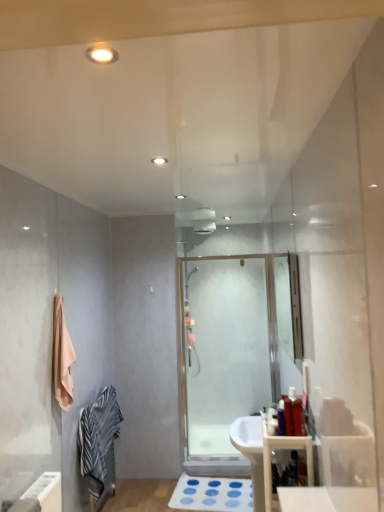
Measure the distance between wooden storage at lower right and camera.

The distance of wooden storage at lower right from camera is 1.92 meters.

Describe the element at coordinates (99, 444) in the screenshot. I see `striped cotton bathrobe at lower left` at that location.

Find the location of a particular element. The image size is (384, 512). wooden storage at lower right is located at coordinates (283, 448).

Considering the relative positions of white glossy light fixture at upper center and striped cotton bathrobe at lower left in the image provided, is white glossy light fixture at upper center behind striped cotton bathrobe at lower left?

No.

Considering the positions of points (96, 58) and (93, 469), is point (96, 58) farther from camera compared to point (93, 469)?

No, it is not.

Is white glossy light fixture at upper center wider or thinner than striped cotton bathrobe at lower left?

In the image, white glossy light fixture at upper center appears to be more narrow than striped cotton bathrobe at lower left.

Which of these two, white glossy light fixture at upper center or striped cotton bathrobe at lower left, stands shorter?

Standing shorter between the two is white glossy light fixture at upper center.

Is wooden storage at lower right in front of or behind white rubber bath mat at lower center in the image?

wooden storage at lower right is in front of white rubber bath mat at lower center.

Does point (265, 503) appear closer or farther from the camera than point (240, 489)?

Point (265, 503) is positioned closer to the camera compared to point (240, 489).

Can you confirm if wooden storage at lower right is thinner than white rubber bath mat at lower center?

Yes, wooden storage at lower right is thinner than white rubber bath mat at lower center.

Is wooden storage at lower right next to white rubber bath mat at lower center?

They are not placed beside each other.

Which of these two, striped cotton bathrobe at lower left or beige cotton towel at left, stands shorter?

With less height is beige cotton towel at left.

Is point (87, 409) closer or farther from the camera than point (65, 381)?

Point (87, 409) is farther from the camera than point (65, 381).

Based on their positions, is striped cotton bathrobe at lower left located to the left or right of beige cotton towel at left?

From the image, it's evident that striped cotton bathrobe at lower left is to the right of beige cotton towel at left.

Considering their positions, is striped cotton bathrobe at lower left located in front of or behind beige cotton towel at left?

striped cotton bathrobe at lower left is behind beige cotton towel at left.

Does clear glass mirror at center lie behind beige cotton towel at left?

No, clear glass mirror at center is closer to the camera.

This screenshot has width=384, height=512. Find the location of `bath towel that appears below the clear glass mirror at center (from a real-world perspective)`. bath towel that appears below the clear glass mirror at center (from a real-world perspective) is located at coordinates (62, 357).

What's the angular difference between clear glass mirror at center and beige cotton towel at left's facing directions?

The facing directions of clear glass mirror at center and beige cotton towel at left are 174 degrees apart.

From the image's perspective, is beige cotton towel at left on top of white glossy light fixture at upper center?

No, from the image's perspective, beige cotton towel at left is not on top of white glossy light fixture at upper center.

Does point (68, 390) lie in front of point (108, 54)?

No, (68, 390) is behind (108, 54).

Are white rubber bath mat at lower center and clear glass mirror at center far apart?

white rubber bath mat at lower center is far away from clear glass mirror at center.

From the image's perspective, between white rubber bath mat at lower center and clear glass mirror at center, which one is located above?

From the image's view, clear glass mirror at center is above.

Can clear glass mirror at center be found inside white rubber bath mat at lower center?

No, clear glass mirror at center is not a part of white rubber bath mat at lower center.

From the image's perspective, which one is positioned lower, matte plastic bottle at right, arranged as the 2th toiletry when viewed from the left, or clear glass mirror at center?

matte plastic bottle at right, arranged as the 2th toiletry when viewed from the left, appears lower in the image.

Does matte plastic bottle at right, arranged as the 2th toiletry when viewed from the left, have a larger size compared to clear glass mirror at center?

No, matte plastic bottle at right, arranged as the 2th toiletry when viewed from the left, is not bigger than clear glass mirror at center.

Would you say matte plastic bottle at right, the 1th toiletry in the right-to-left sequence, is outside clear glass mirror at center?

Indeed, matte plastic bottle at right, the 1th toiletry in the right-to-left sequence, is completely outside clear glass mirror at center.

Considering the relative positions of matte plastic bottle at right, the 1th toiletry in the right-to-left sequence, and clear glass mirror at center in the image provided, is matte plastic bottle at right, the 1th toiletry in the right-to-left sequence, to the left or to the right of clear glass mirror at center?

matte plastic bottle at right, the 1th toiletry in the right-to-left sequence, is to the left of clear glass mirror at center.

At what (x,y) coordinates should I click in order to perform the action: click on bathrobe on the left of white glossy light fixture at upper center. Please return your answer as a coordinate pair (x, y). Image resolution: width=384 pixels, height=512 pixels. Looking at the image, I should click on (99, 444).

The width and height of the screenshot is (384, 512). I want to click on bath mat that is below the wooden storage at lower right (from the image's perspective), so click(212, 494).

Based on their spatial positions, is striped cotton bathrobe at lower left or matte plastic bottle at right, arranged as the 2th toiletry when viewed from the left, further from white rubber bath mat at lower center?

matte plastic bottle at right, arranged as the 2th toiletry when viewed from the left, is positioned further to the anchor white rubber bath mat at lower center.

Based on their spatial positions, is wooden storage at lower right or transparent glass shower door at center closer to clear glass mirror at center?

The object closer to clear glass mirror at center is transparent glass shower door at center.

Based on their spatial positions, is white rubber bath mat at lower center or beige cotton towel at left closer to matte plastic toothbrush at center, the second toiletry in the right-to-left sequence?

beige cotton towel at left lies closer to matte plastic toothbrush at center, the second toiletry in the right-to-left sequence, than the other object.

Based on their spatial positions, is transparent glass shower door at center or white glossy light fixture at upper center closer to wooden storage at lower right?

Among the two, white glossy light fixture at upper center is located nearer to wooden storage at lower right.

Looking at the image, which one is located closer to wooden storage at lower right, white glossy light fixture at upper center or matte plastic bottle at right, arranged as the 2th toiletry when viewed from the left?

matte plastic bottle at right, arranged as the 2th toiletry when viewed from the left, is positioned closer to the anchor wooden storage at lower right.

From the image, which object appears to be nearer to clear glass mirror at center, wooden storage at lower right or striped cotton bathrobe at lower left?

The object closer to clear glass mirror at center is striped cotton bathrobe at lower left.

Looking at the image, which one is located closer to beige cotton towel at left, striped cotton bathrobe at lower left or matte plastic bottle at right, the 1th toiletry in the right-to-left sequence?

striped cotton bathrobe at lower left is positioned closer to the anchor beige cotton towel at left.

Which object lies nearer to the anchor point clear glass mirror at center, white glossy light fixture at upper center or striped cotton bathrobe at lower left?

striped cotton bathrobe at lower left.

Identify the location of bathroom cabinet between clear glass mirror at center and white rubber bath mat at lower center in the up-down direction. (283, 448).

This screenshot has width=384, height=512. I want to click on bath towel between white glossy light fixture at upper center and transparent glass shower door at center from front to back, so click(x=62, y=357).

Where is `mirror located between matte plastic bottle at right, the 1th toiletry in the right-to-left sequence, and transparent glass shower door at center in the depth direction`? This screenshot has height=512, width=384. mirror located between matte plastic bottle at right, the 1th toiletry in the right-to-left sequence, and transparent glass shower door at center in the depth direction is located at coordinates (289, 306).

At what (x,y) coordinates should I click in order to perform the action: click on mirror located between white glossy light fixture at upper center and transparent glass shower door at center in the depth direction. Please return your answer as a coordinate pair (x, y). This screenshot has width=384, height=512. Looking at the image, I should click on (289, 306).